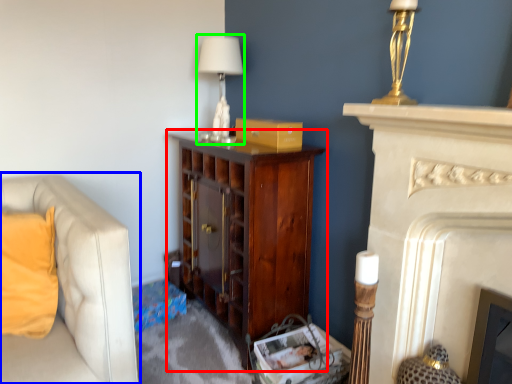
Question: Which object is positioned farthest from cabinetry (highlighted by a red box)? Select from studio couch (highlighted by a blue box) and table lamp (highlighted by a green box).

Choices:
 (A) studio couch
 (B) table lamp

Answer: (A)